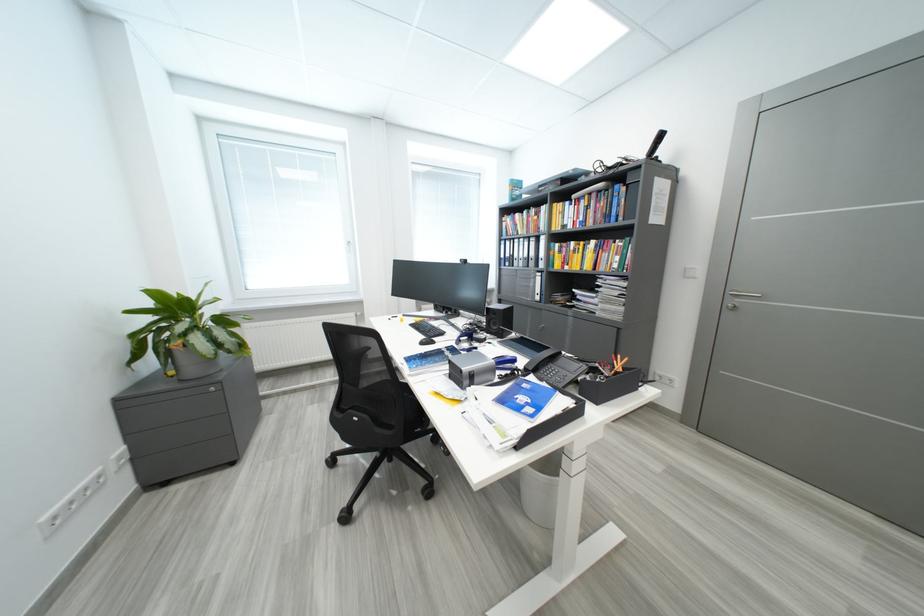
Describe the element at coordinates (427, 329) in the screenshot. I see `the keyboard key` at that location.